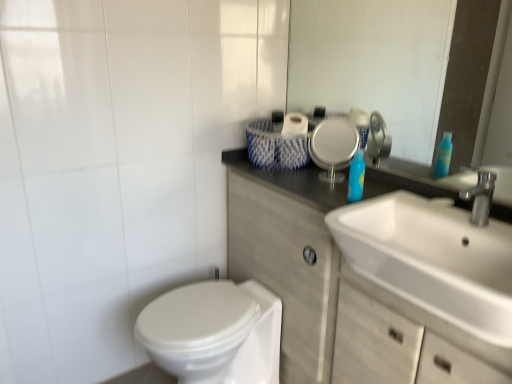
Where is `white matte cabinet at center`? Image resolution: width=512 pixels, height=384 pixels. white matte cabinet at center is located at coordinates [317, 274].

At what (x,y) coordinates should I click in order to perform the action: click on blue glossy bottle at upper right. Please return your answer as a coordinate pair (x, y). The image size is (512, 384). Looking at the image, I should click on (356, 177).

You are a GUI agent. You are given a task and a screenshot of the screen. Output one action in this format:
    pyautogui.click(x=<x>, y=<y>)
    Task: Click on the white glossy bidet at lower left
    The width and height of the screenshot is (512, 384).
    Given the screenshot: What is the action you would take?
    pyautogui.click(x=214, y=333)

Identify the location of white matte cabinet at center. The height and width of the screenshot is (384, 512). (317, 274).

Can you confirm if white woven basket at upper center is taller than glossy glass mirror at upper center?

No, white woven basket at upper center is not taller than glossy glass mirror at upper center.

From the image's perspective, who appears lower, white woven basket at upper center or glossy glass mirror at upper center?

white woven basket at upper center is shown below in the image.

Does point (303, 120) appear closer or farther from the camera than point (468, 147)?

Point (303, 120) appears to be closer to the viewer than point (468, 147).

Would you say white woven basket at upper center is inside or outside glossy glass mirror at upper center?

The correct answer is: outside.

Is point (421, 299) farther from camera compared to point (344, 55)?

No, it is not.

The width and height of the screenshot is (512, 384). In order to click on mirror that is above the white glossy sink at right (from a real-world perspective) in this screenshot , I will do (325, 52).

How different are the orientations of white glossy sink at right and glossy glass mirror at upper center in degrees?

The angle between the facing direction of white glossy sink at right and the facing direction of glossy glass mirror at upper center is 0.677 degrees.

Considering the positions of objects white glossy sink at right and glossy glass mirror at upper center in the image provided, who is more to the left, white glossy sink at right or glossy glass mirror at upper center?

glossy glass mirror at upper center is more to the left.

Considering the points (318, 97) and (262, 300), which point is behind, point (318, 97) or point (262, 300)?

The point (318, 97) is farther.

Does glossy glass mirror at upper center contain white glossy bidet at lower left?

No, white glossy bidet at lower left is not a part of glossy glass mirror at upper center.

Locate an element on the screen. The height and width of the screenshot is (384, 512). bidet below the glossy glass mirror at upper center (from a real-world perspective) is located at coordinates (214, 333).

From a real-world perspective, relative to white glossy bidet at lower left, is glossy glass mirror at upper center vertically above or below?

glossy glass mirror at upper center is situated higher than white glossy bidet at lower left in the real world.

Considering the positions of objects white matte cabinet at center and blue glossy bottle at upper right in the image provided, who is more to the left, white matte cabinet at center or blue glossy bottle at upper right?

blue glossy bottle at upper right is more to the left.

From the picture: Is white matte cabinet at center facing away from blue glossy bottle at upper right?

That's not correct — white matte cabinet at center is not looking away from blue glossy bottle at upper right.

From a real-world perspective, between white matte cabinet at center and blue glossy bottle at upper right, who is vertically higher?

blue glossy bottle at upper right.

Identify the location of toiletry that appears above the white matte cabinet at center (from a real-world perspective). (356, 177).

Between point (352, 173) and point (302, 156), which one is positioned in front?

The point (352, 173) is closer.

Is the surface of blue glossy bottle at upper right in direct contact with white woven basket at upper center?

No, blue glossy bottle at upper right is not next to white woven basket at upper center.

The width and height of the screenshot is (512, 384). In the image, there is a white woven basket at upper center. Identify the location of toiletry below it (from a real-world perspective). (356, 177).

From the image's perspective, between blue glossy bottle at upper right and white woven basket at upper center, who is located below?

blue glossy bottle at upper right, from the image's perspective.

Consider the image. Is white glossy sink at right surrounded by white woven basket at upper center?

No, white glossy sink at right is not a part of white woven basket at upper center.

Is white woven basket at upper center bigger than white glossy sink at right?

Incorrect, white woven basket at upper center is not larger than white glossy sink at right.

Is white woven basket at upper center touching white glossy sink at right?

No, white woven basket at upper center is not making contact with white glossy sink at right.

From the image's perspective, which one is positioned lower, white woven basket at upper center or white glossy sink at right?

white glossy sink at right appears lower in the image.

Does point (302, 154) come farther from viewer compared to point (356, 162)?

Yes, point (302, 154) is behind point (356, 162).

Is white woven basket at upper center directly adjacent to blue glossy bottle at upper right?

white woven basket at upper center and blue glossy bottle at upper right are not in contact.

From the image's perspective, who appears lower, white woven basket at upper center or blue glossy bottle at upper right?

blue glossy bottle at upper right.

Is white woven basket at upper center inside or outside of blue glossy bottle at upper right?

white woven basket at upper center is located beyond the bounds of blue glossy bottle at upper right.

Identify the location of toilet paper below the glossy glass mirror at upper center (from the image's perspective). This screenshot has width=512, height=384. (293, 142).

Locate an element on the screen. mirror positioned vertically above the white glossy sink at right (from a real-world perspective) is located at coordinates (325, 52).

Looking at the image, which one is located further to white matte cabinet at center, blue glossy bottle at upper right or white woven basket at upper center?

Among the two, white woven basket at upper center is located further to white matte cabinet at center.

When comparing their distances from glossy glass mirror at upper center, does blue glossy bottle at upper right or white matte cabinet at center seem closer?

blue glossy bottle at upper right lies closer to glossy glass mirror at upper center than the other object.

Looking at the image, which one is located further to white glossy sink at right, glossy glass mirror at upper center or blue glossy bottle at upper right?

Based on the image, glossy glass mirror at upper center appears to be further to white glossy sink at right.

When comparing their distances from white woven basket at upper center, does blue glossy bottle at upper right or white matte cabinet at center seem closer?

blue glossy bottle at upper right is closer to white woven basket at upper center.

When comparing their distances from glossy glass mirror at upper center, does white woven basket at upper center or white matte cabinet at center seem closer?

white woven basket at upper center lies closer to glossy glass mirror at upper center than the other object.

Consider the image. Considering their positions, is blue glossy bottle at upper right positioned closer to white glossy sink at right than glossy glass mirror at upper center?

blue glossy bottle at upper right.

From the image, which object appears to be farther from white glossy sink at right, blue glossy bottle at upper right or white glossy bidet at lower left?

white glossy bidet at lower left is further to white glossy sink at right.

Which object lies further to the anchor point white woven basket at upper center, blue glossy bottle at upper right or white glossy sink at right?

Based on the image, white glossy sink at right appears to be further to white woven basket at upper center.

Where is `toilet paper between glossy glass mirror at upper center and white matte cabinet at center vertically`? The height and width of the screenshot is (384, 512). toilet paper between glossy glass mirror at upper center and white matte cabinet at center vertically is located at coordinates (293, 142).

What are the coordinates of `toiletry that lies between white woven basket at upper center and white glossy bidet at lower left from top to bottom` in the screenshot? It's located at (356, 177).

At what (x,y) coordinates should I click in order to perform the action: click on toiletry between glossy glass mirror at upper center and white glossy bidet at lower left in the up-down direction. Please return your answer as a coordinate pair (x, y). The height and width of the screenshot is (384, 512). Looking at the image, I should click on [356, 177].

What are the coordinates of `sink between white woven basket at upper center and white glossy bidet at lower left from top to bottom` in the screenshot? It's located at (436, 255).